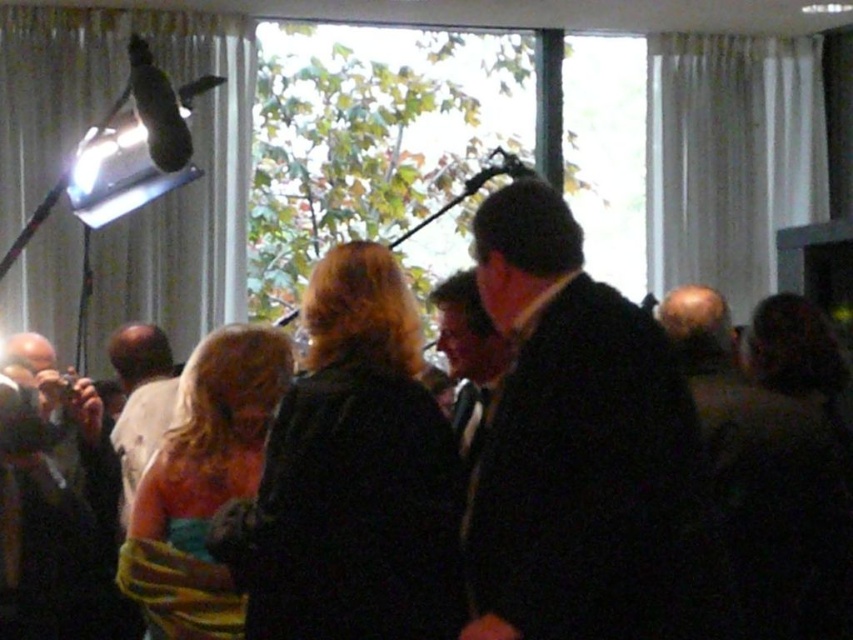
Question: Considering the real-world distances, which object is closest to the black wool coat at center?

Choices:
 (A) light brown hair at center
 (B) dark brown leather jacket at lower left

Answer: (B)

Question: Among these objects, which one is nearest to the camera?

Choices:
 (A) black wool coat at center
 (B) light brown hair at center
 (C) dark brown leather jacket at lower left

Answer: (A)

Question: Where is black wool coat at center located in relation to light brown hair at center in the image?

Choices:
 (A) right
 (B) left

Answer: (A)

Question: Which of these objects is positioned closest to the black wool coat at center?

Choices:
 (A) dark brown leather jacket at lower left
 (B) light brown hair at center

Answer: (A)

Question: Is dark brown leather jacket at lower left above light brown hair at center?

Choices:
 (A) no
 (B) yes

Answer: (A)

Question: Does black wool coat at center have a smaller size compared to light brown hair at center?

Choices:
 (A) no
 (B) yes

Answer: (B)